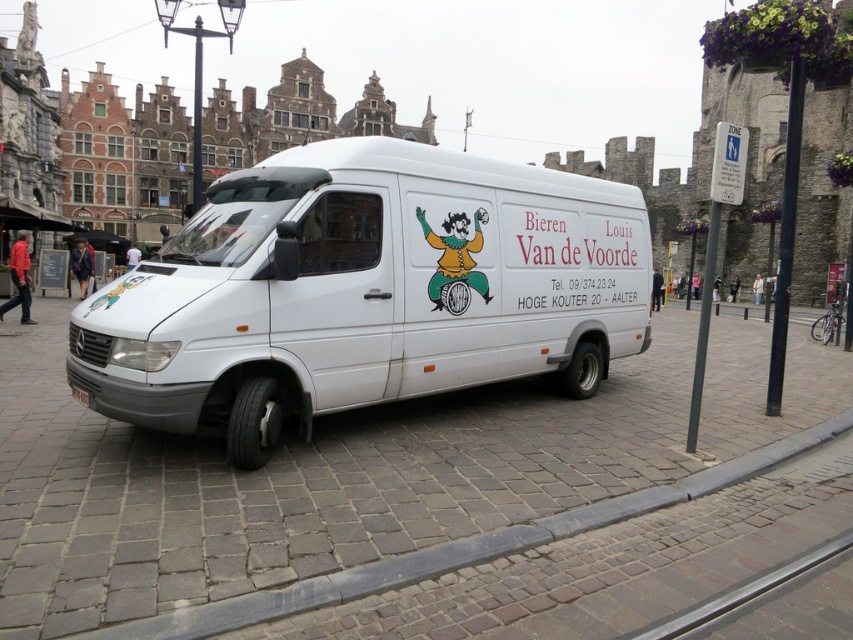
You are a delivery driver who needs to park your white matte van at center in a historic town square with cobblestone streets. The van has a length of 6 meters. The parking spot you want to use is marked at coordinates between points 0.4 and 0.45 on the X and Y axes. Will your van fit in this parking spot?

The white matte van at center is positioned at point [364,291], which is slightly beyond the parking spot marked between 0.4 and 0.45 on both axes. Therefore, the van will not fit entirely within the designated parking area.

You are a delivery driver who needs to park your white matte van at center in a historic town square with narrow streets. The gray concrete curb at lower center is part of the sidewalk. Can you safely park your van so that it doesn not block the sidewalk?

The white matte van at center is positioned on the left side of the gray concrete curb at lower center, which marks the sidewalk. To avoid blocking the sidewalk, you should park your van to the left of the curb, ensuring it stays on the street side. Since the curb is at the lower center, positioning the van to the left of it would keep the sidewalk clear.